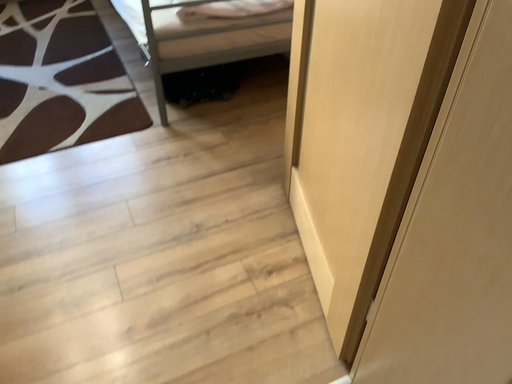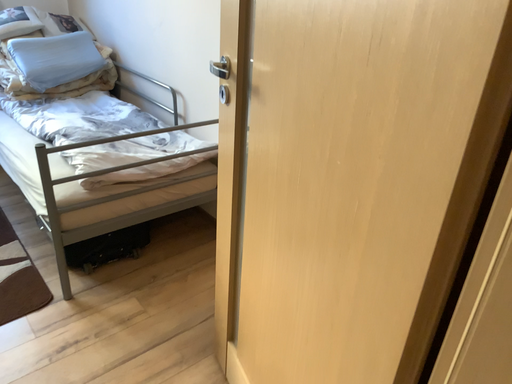
Question: Which way did the camera rotate in the video?

Choices:
 (A) rotated downward
 (B) rotated upward

Answer: (B)